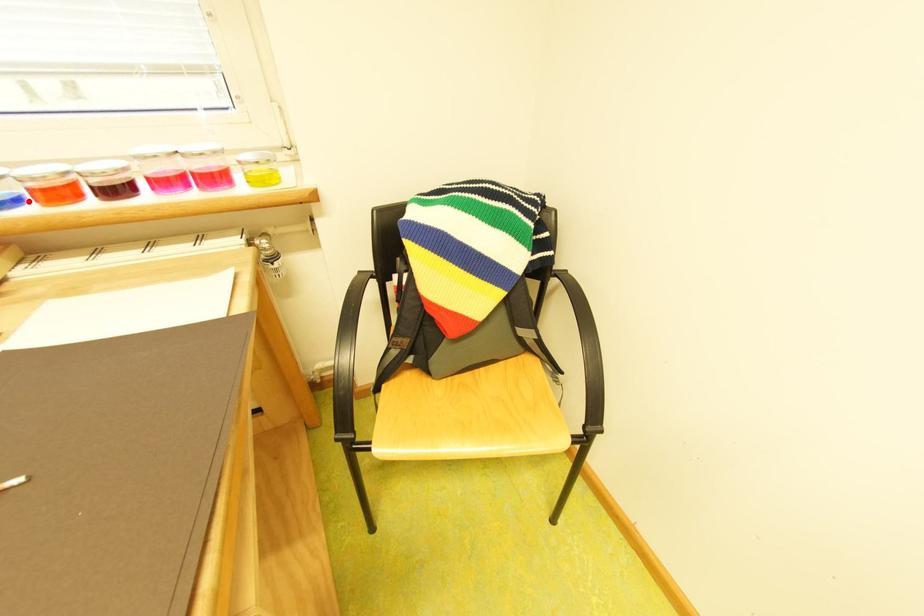
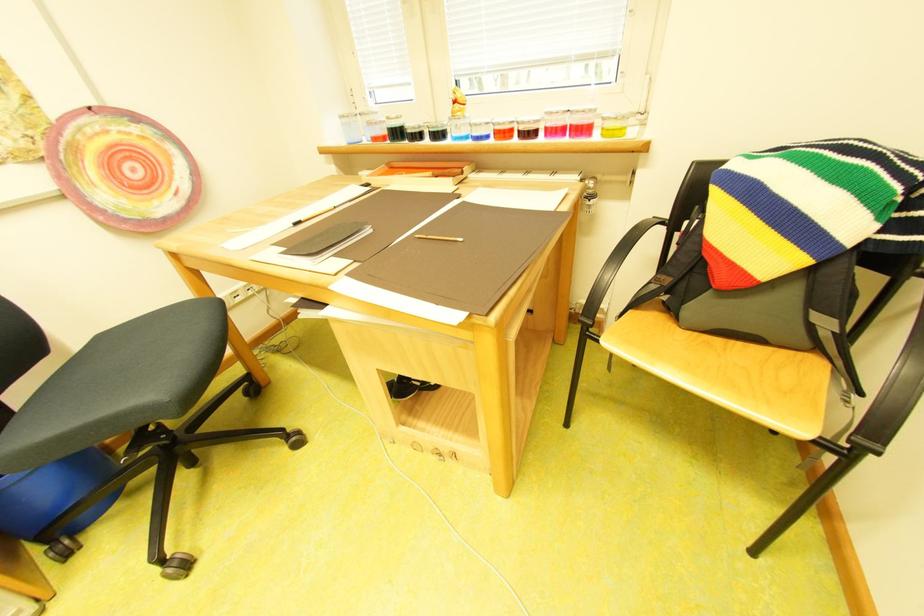
Question: I am providing you with two images of the same scene from different viewpoints. Image1 has a red point marked. In image2, the corresponding 3D location appears at what relative position? Reply with the corresponding letter.

Choices:
 (A) Closer
 (B) Farther

Answer: (A)